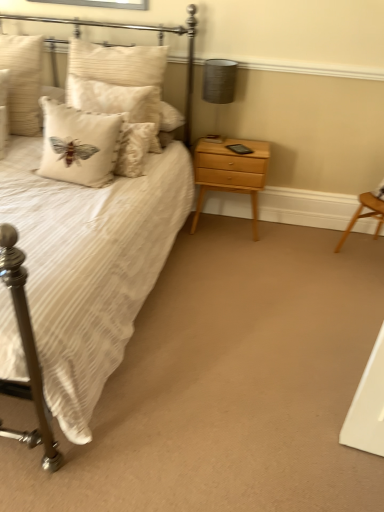
The image size is (384, 512). What do you see at coordinates (121, 67) in the screenshot?
I see `white textured pillow at upper left, the 1th pillow viewed from the right` at bounding box center [121, 67].

Measure the distance between beige textured pillow at upper left, the third pillow from the right, and camera.

The depth of beige textured pillow at upper left, the third pillow from the right, is 2.49 meters.

Find the location of a particular element. The width and height of the screenshot is (384, 512). beige textured pillow at upper left, the third pillow from the right is located at coordinates (23, 81).

The width and height of the screenshot is (384, 512). Find the location of `light wood/texture nightstand at right`. light wood/texture nightstand at right is located at coordinates (230, 173).

What are the coordinates of `white textured cushion at upper left, arranged as the 2th pillow when viewed from the left` in the screenshot? It's located at (79, 144).

Is white textured pillow at upper left, which is the 3th pillow in left-to-right order, situated inside matte gray lampshade at upper right or outside?

white textured pillow at upper left, which is the 3th pillow in left-to-right order, is not enclosed by matte gray lampshade at upper right.

Is white textured pillow at upper left, the 1th pillow viewed from the right, bigger or smaller than matte gray lampshade at upper right?

white textured pillow at upper left, the 1th pillow viewed from the right, is bigger than matte gray lampshade at upper right.

From the image's perspective, between white textured pillow at upper left, which is the 3th pillow in left-to-right order, and matte gray lampshade at upper right, who is located below?

From the image's view, white textured pillow at upper left, which is the 3th pillow in left-to-right order, is below.

Is white textured pillow at upper left, which is the 3th pillow in left-to-right order, wider than matte gray lampshade at upper right?

Yes.

Could you tell me if matte gray lampshade at upper right is turned towards light wood/texture nightstand at right?

No, matte gray lampshade at upper right is not oriented towards light wood/texture nightstand at right.

From the image's perspective, is matte gray lampshade at upper right beneath light wood/texture nightstand at right?

Incorrect, from the image's perspective, matte gray lampshade at upper right is higher than light wood/texture nightstand at right.

Based on the photo, considering the sizes of matte gray lampshade at upper right and light wood/texture nightstand at right in the image, is matte gray lampshade at upper right wider or thinner than light wood/texture nightstand at right?

Clearly, matte gray lampshade at upper right has less width compared to light wood/texture nightstand at right.

Based on the photo, who is taller, matte gray lampshade at upper right or light wood/texture nightstand at right?

light wood/texture nightstand at right.

From a real-world perspective, does light wood/texture nightstand at right stand above white striped fabric bed at left?

Actually, light wood/texture nightstand at right is physically below white striped fabric bed at left in the real world.

Is light wood/texture nightstand at right wider than white striped fabric bed at left?

Incorrect, the width of light wood/texture nightstand at right does not surpass that of white striped fabric bed at left.

From the image's perspective, would you say light wood/texture nightstand at right is positioned over white striped fabric bed at left?

No, from the image's perspective, light wood/texture nightstand at right is not over white striped fabric bed at left.

Is white textured cushion at upper left, which appears as the second pillow when viewed from the right, at the right side of light wood/texture nightstand at right?

Incorrect, white textured cushion at upper left, which appears as the second pillow when viewed from the right, is not on the right side of light wood/texture nightstand at right.

Is white textured cushion at upper left, arranged as the 2th pillow when viewed from the left, facing towards light wood/texture nightstand at right?

No, white textured cushion at upper left, arranged as the 2th pillow when viewed from the left, is not turned towards light wood/texture nightstand at right.

In the scene shown: Considering the sizes of objects white striped fabric bed at left and matte gray lampshade at upper right in the image provided, who is thinner, white striped fabric bed at left or matte gray lampshade at upper right?

matte gray lampshade at upper right is thinner.

Does white striped fabric bed at left come behind matte gray lampshade at upper right?

No, white striped fabric bed at left is closer to the camera.

Is white striped fabric bed at left shorter than matte gray lampshade at upper right?

Incorrect, the height of white striped fabric bed at left does not fall short of that of matte gray lampshade at upper right.

Would you consider matte gray lampshade at upper right to be distant from white striped fabric bed at left?

matte gray lampshade at upper right is actually quite close to white striped fabric bed at left.

Does point (233, 75) appear closer or farther from the camera than point (109, 27)?

Point (233, 75) is closer to the camera than point (109, 27).

Considering the sizes of objects matte gray lampshade at upper right and white striped fabric bed at left in the image provided, who is shorter, matte gray lampshade at upper right or white striped fabric bed at left?

matte gray lampshade at upper right is shorter.

Do you think matte gray lampshade at upper right is within white striped fabric bed at left, or outside of it?

matte gray lampshade at upper right is not enclosed by white striped fabric bed at left.

From the image's perspective, between light wood/texture nightstand at right and white textured pillow at upper left, the 1th pillow viewed from the right, which one is located above?

From the image's view, white textured pillow at upper left, the 1th pillow viewed from the right, is above.

Which of these two, light wood/texture nightstand at right or white textured pillow at upper left, the 1th pillow viewed from the right, is smaller?

With smaller size is light wood/texture nightstand at right.

From a real-world perspective, is light wood/texture nightstand at right positioned under white textured pillow at upper left, the 1th pillow viewed from the right, based on gravity?

Indeed, from a real-world perspective, light wood/texture nightstand at right is positioned beneath white textured pillow at upper left, the 1th pillow viewed from the right.

Find the location of `nightstand on the right of white textured pillow at upper left, which is the 3th pillow in left-to-right order`. nightstand on the right of white textured pillow at upper left, which is the 3th pillow in left-to-right order is located at coordinates (230, 173).

The width and height of the screenshot is (384, 512). Find the location of `table lamp behind the white textured pillow at upper left, which is the 3th pillow in left-to-right order`. table lamp behind the white textured pillow at upper left, which is the 3th pillow in left-to-right order is located at coordinates (219, 85).

Where is `table lamp on the left of light wood/texture nightstand at right`? The image size is (384, 512). table lamp on the left of light wood/texture nightstand at right is located at coordinates pyautogui.click(x=219, y=85).

Considering their positions, is white textured cushion at upper left, arranged as the 2th pillow when viewed from the left, positioned further to beige textured pillow at upper left, placed as the first pillow when sorted from left to right, than white striped fabric bed at left?

Among the two, white striped fabric bed at left is located further to beige textured pillow at upper left, placed as the first pillow when sorted from left to right.

Looking at the image, which one is located closer to light wood/texture nightstand at right, white textured pillow at upper left, the 1th pillow viewed from the right, or white textured cushion at upper left, arranged as the 2th pillow when viewed from the left?

white textured pillow at upper left, the 1th pillow viewed from the right, is closer to light wood/texture nightstand at right.

Looking at this image, considering their positions, is white textured pillow at upper left, the 1th pillow viewed from the right, positioned closer to white textured cushion at upper left, which appears as the second pillow when viewed from the right, than matte gray lampshade at upper right?

Based on the image, white textured pillow at upper left, the 1th pillow viewed from the right, appears to be nearer to white textured cushion at upper left, which appears as the second pillow when viewed from the right.

Which object lies nearer to the anchor point white striped fabric bed at left, light wood/texture nightstand at right or beige textured pillow at upper left, placed as the first pillow when sorted from left to right?

light wood/texture nightstand at right.

Which object lies further to the anchor point light wood/texture nightstand at right, beige textured pillow at upper left, the third pillow from the right, or white textured cushion at upper left, which appears as the second pillow when viewed from the right?

beige textured pillow at upper left, the third pillow from the right, lies further to light wood/texture nightstand at right than the other object.

Looking at the image, which one is located closer to white textured pillow at upper left, which is the 3th pillow in left-to-right order, white textured cushion at upper left, arranged as the 2th pillow when viewed from the left, or beige textured pillow at upper left, placed as the first pillow when sorted from left to right?

Among the two, beige textured pillow at upper left, placed as the first pillow when sorted from left to right, is located nearer to white textured pillow at upper left, which is the 3th pillow in left-to-right order.

Looking at this image, based on their spatial positions, is white striped fabric bed at left or beige textured pillow at upper left, placed as the first pillow when sorted from left to right, closer to white textured cushion at upper left, which appears as the second pillow when viewed from the right?

beige textured pillow at upper left, placed as the first pillow when sorted from left to right.

Considering their positions, is beige textured pillow at upper left, placed as the first pillow when sorted from left to right, positioned further to matte gray lampshade at upper right than white striped fabric bed at left?

The object further to matte gray lampshade at upper right is beige textured pillow at upper left, placed as the first pillow when sorted from left to right.

Where is `table lamp between white striped fabric bed at left and light wood/texture nightstand at right from front to back`? table lamp between white striped fabric bed at left and light wood/texture nightstand at right from front to back is located at coordinates (219, 85).

What are the coordinates of `table lamp between white textured cushion at upper left, which appears as the second pillow when viewed from the right, and light wood/texture nightstand at right` in the screenshot? It's located at (219, 85).

Where is `pillow between white textured cushion at upper left, which appears as the second pillow when viewed from the right, and matte gray lampshade at upper right, in the horizontal direction`? The height and width of the screenshot is (512, 384). pillow between white textured cushion at upper left, which appears as the second pillow when viewed from the right, and matte gray lampshade at upper right, in the horizontal direction is located at coordinates (121, 67).

Where is `pillow situated between white textured cushion at upper left, which appears as the second pillow when viewed from the right, and light wood/texture nightstand at right from left to right`? pillow situated between white textured cushion at upper left, which appears as the second pillow when viewed from the right, and light wood/texture nightstand at right from left to right is located at coordinates (121, 67).